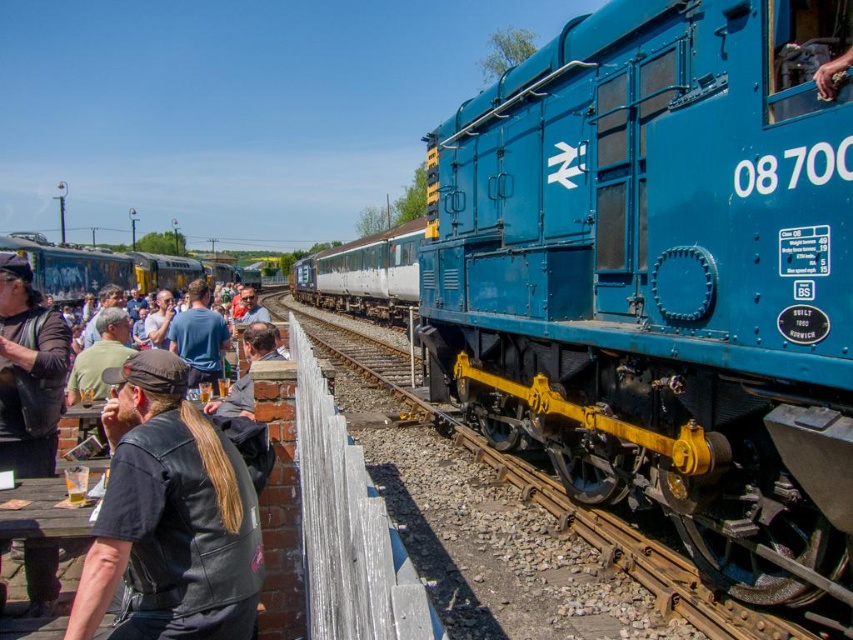
Question: Which point is farther to the camera?

Choices:
 (A) (204, 330)
 (B) (769, 616)

Answer: (A)

Question: Which point is farther from the camera taking this photo?

Choices:
 (A) (688, 324)
 (B) (97, 460)
 (C) (611, 522)

Answer: (C)

Question: Can you confirm if blue metallic train at center is positioned below blue cotton shirt at center?

Choices:
 (A) yes
 (B) no

Answer: (B)

Question: Does blue metallic train at center have a greater width compared to blue cotton shirt at center?

Choices:
 (A) no
 (B) yes

Answer: (A)

Question: Which point is closer to the camera taking this photo?

Choices:
 (A) (62, 289)
 (B) (721, 612)
 (C) (82, 515)

Answer: (C)

Question: Does yellow metal train track at center appear under wooden picnic table at lower left?

Choices:
 (A) yes
 (B) no

Answer: (B)